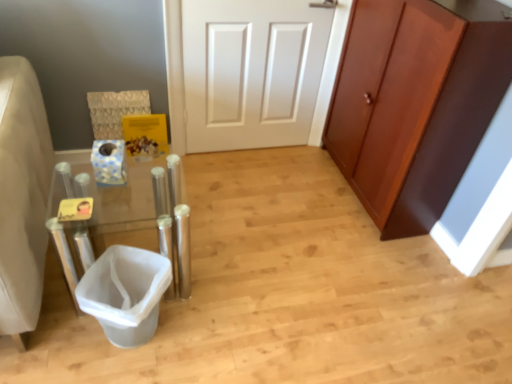
Question: Is brown wood cabinet at right oriented away from white plastic trash can at lower left?

Choices:
 (A) yes
 (B) no

Answer: (B)

Question: Considering the relative sizes of brown wood cabinet at right and white plastic trash can at lower left in the image provided, is brown wood cabinet at right bigger than white plastic trash can at lower left?

Choices:
 (A) no
 (B) yes

Answer: (B)

Question: Is brown wood cabinet at right next to white plastic trash can at lower left?

Choices:
 (A) no
 (B) yes

Answer: (A)

Question: Is brown wood cabinet at right oriented towards white plastic trash can at lower left?

Choices:
 (A) yes
 (B) no

Answer: (A)

Question: Does brown wood cabinet at right have a lesser height compared to white plastic trash can at lower left?

Choices:
 (A) no
 (B) yes

Answer: (A)

Question: Considering the relative sizes of brown wood cabinet at right and white plastic trash can at lower left in the image provided, is brown wood cabinet at right smaller than white plastic trash can at lower left?

Choices:
 (A) yes
 (B) no

Answer: (B)

Question: Considering the relative sizes of clear acrylic vanity at left and brown wood cabinet at right in the image provided, is clear acrylic vanity at left shorter than brown wood cabinet at right?

Choices:
 (A) no
 (B) yes

Answer: (B)

Question: From a real-world perspective, is clear acrylic vanity at left physically below brown wood cabinet at right?

Choices:
 (A) yes
 (B) no

Answer: (A)

Question: Considering the relative sizes of clear acrylic vanity at left and brown wood cabinet at right in the image provided, is clear acrylic vanity at left smaller than brown wood cabinet at right?

Choices:
 (A) yes
 (B) no

Answer: (A)

Question: Would you say brown wood cabinet at right is part of clear acrylic vanity at left's contents?

Choices:
 (A) yes
 (B) no

Answer: (B)

Question: Could you tell me if clear acrylic vanity at left is facing brown wood cabinet at right?

Choices:
 (A) yes
 (B) no

Answer: (B)

Question: Is clear acrylic vanity at left touching brown wood cabinet at right?

Choices:
 (A) yes
 (B) no

Answer: (B)

Question: Can you confirm if white plastic trash can at lower left is shorter than brown wood cabinet at right?

Choices:
 (A) no
 (B) yes

Answer: (B)